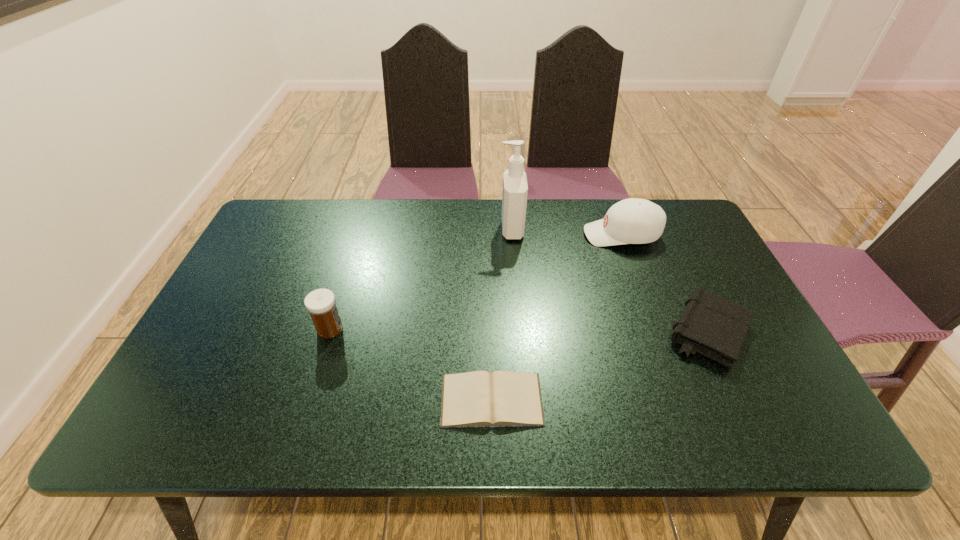
Identify the location of vacant space located on the front-facing side of the baseball cap. [x=487, y=235].

You are a GUI agent. You are given a task and a screenshot of the screen. Output one action in this format:
    pyautogui.click(x=<x>, y=<y>)
    Task: Click on the free space located on the front-facing side of the baseball cap
    
    Given the screenshot: What is the action you would take?
    pyautogui.click(x=548, y=235)

In order to click on vacant space located 0.230m on the front-facing side of the baseball cap in this screenshot , I will do `click(510, 235)`.

Find the location of a particular element. This screenshot has height=540, width=960. blank space located on the back of the leftmost object is located at coordinates (349, 268).

In order to click on free space located on the back of the fourth tallest object in this screenshot , I will do `click(673, 256)`.

At what (x,y) coordinates should I click in order to perform the action: click on vacant space located 0.290m on the right of the nearest object. Please return your answer as a coordinate pair (x, y). This screenshot has height=540, width=960. Looking at the image, I should click on (677, 400).

Where is `cleansing agent located in the far edge section of the desktop`? cleansing agent located in the far edge section of the desktop is located at coordinates (x=515, y=188).

Locate an element on the screen. baseball cap that is at the far edge is located at coordinates (631, 221).

I want to click on object present at the near edge, so click(502, 398).

Where is `baseball cap located at the right edge`? The image size is (960, 540). baseball cap located at the right edge is located at coordinates (631, 221).